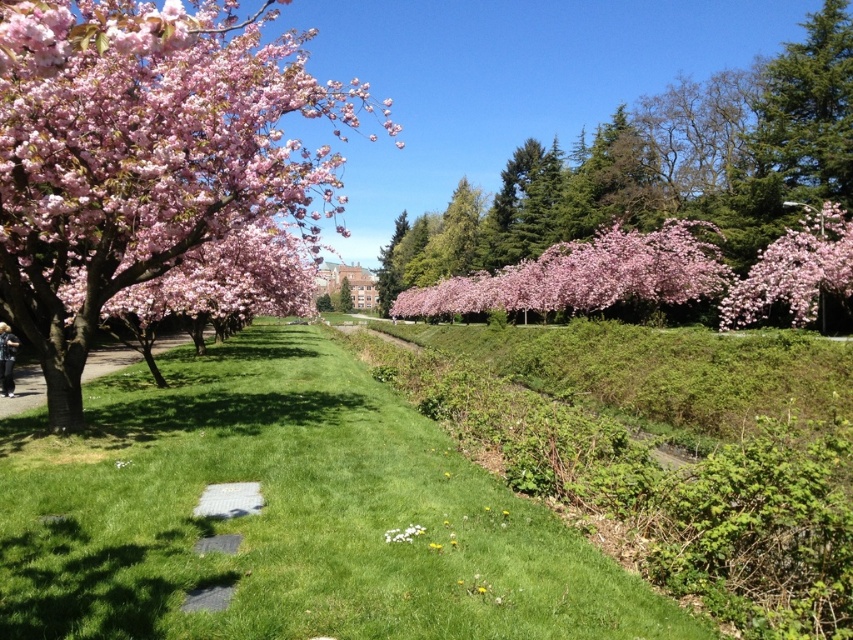
Question: Which point is farther to the camera?

Choices:
 (A) (85, 253)
 (B) (651, 294)
 (C) (756, 236)
 (D) (341, 305)

Answer: (D)

Question: Which object is positioned farthest from the pink blossoms at center?

Choices:
 (A) white fluffy flower at center
 (B) pink matte flower at upper left
 (C) green grass at center
 (D) pink matte flower at upper right

Answer: (A)

Question: Can you confirm if pink matte flower at upper left is positioned below pink matte flower at center?

Choices:
 (A) yes
 (B) no

Answer: (B)

Question: Is green grass at center to the left of green leafy tree at center from the viewer's perspective?

Choices:
 (A) yes
 (B) no

Answer: (B)

Question: Which point is closer to the camera?

Choices:
 (A) (373, 417)
 (B) (843, 240)
 (C) (352, 93)

Answer: (C)

Question: Does pink matte flower at upper left have a larger size compared to pink matte flower at upper right?

Choices:
 (A) no
 (B) yes

Answer: (B)